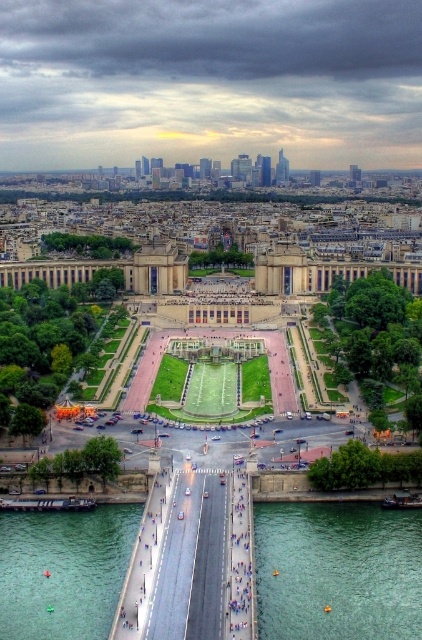
You are a city planner assessing the safety of the green water at bridge right for public access. The safety regulations require a minimum distance of 80 meters between the water and the nearest pedestrian path. Based on the provided information, is the current distance compliant with the regulations?

The green water at bridge right is 79.41 meters away from the nearest pedestrian path, which is less than the required 80 meters. Therefore, it does not comply with the safety regulations.

You are a city planner analyzing the bridge layout. You notice two areas of green water at bridge right and green water at bridge center. Which area requires more maintenance if the larger body of water needs more attention?

The green water at bridge right requires more maintenance because it is larger in size than the green water at bridge center, and larger bodies of water typically need more attention.